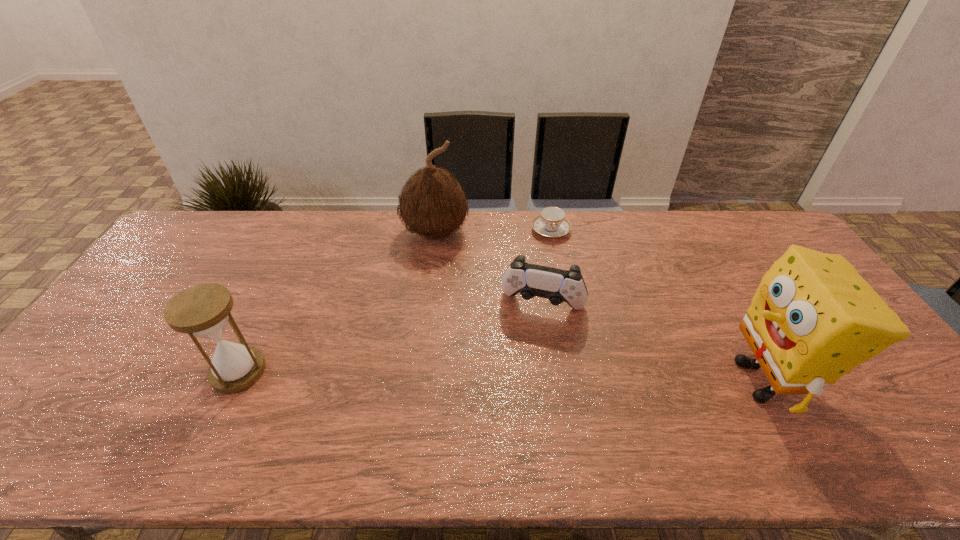
Locate an element on the screen. The width and height of the screenshot is (960, 540). free spot between the fourth object from right to left and the teacup is located at coordinates (493, 232).

Where is `vacant space in between the coconut and the leftmost object`? This screenshot has width=960, height=540. vacant space in between the coconut and the leftmost object is located at coordinates (337, 302).

Locate an element on the screen. The width and height of the screenshot is (960, 540). vacant area that lies between the coconut and the control is located at coordinates (490, 269).

Identify the location of vacant space in between the leftmost object and the teacup. This screenshot has height=540, width=960. (395, 301).

Locate an element on the screen. unoccupied position between the control and the hourglass is located at coordinates (391, 339).

Image resolution: width=960 pixels, height=540 pixels. Identify the location of free point between the shortest object and the hourglass. (395, 301).

This screenshot has height=540, width=960. What are the coordinates of `vacant region between the coconut and the third nearest object` in the screenshot? It's located at (490, 269).

Where is `blank region between the sponge and the third shortest object`? This screenshot has width=960, height=540. blank region between the sponge and the third shortest object is located at coordinates (500, 376).

Point out which object is positioned as the third nearest to the second shortest object. Please provide its 2D coordinates. Your answer should be formatted as a tuple, i.e. [(x, y)], where the tuple contains the x and y coordinates of a point satisfying the conditions above.

[(813, 318)]

Select which object is the fourth closest to the coconut. Please provide its 2D coordinates. Your answer should be formatted as a tuple, i.e. [(x, y)], where the tuple contains the x and y coordinates of a point satisfying the conditions above.

[(813, 318)]